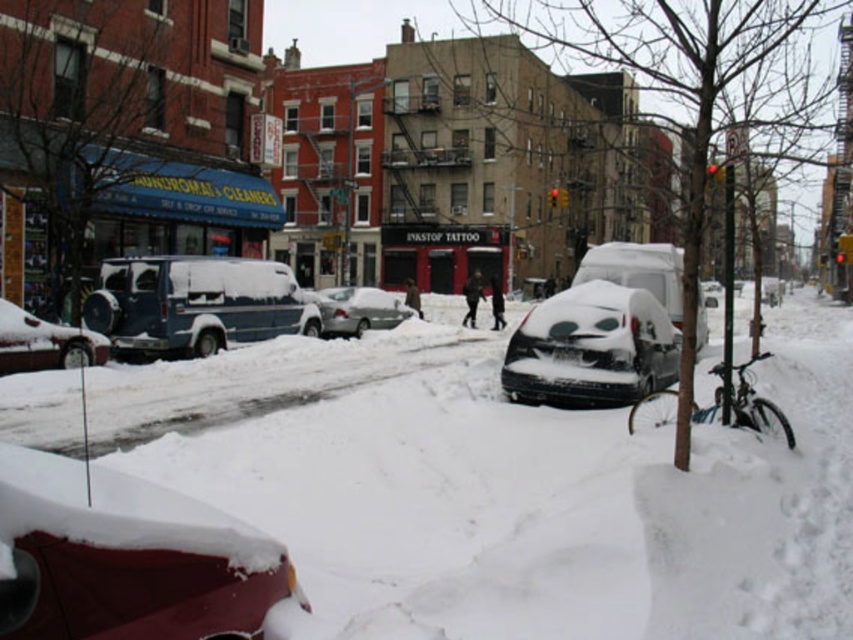
Who is taller, white fluffy snow at center or snow-covered car at center?

With more height is snow-covered car at center.

Can you confirm if white fluffy snow at center is shorter than snow-covered car at center?

Indeed, white fluffy snow at center has a lesser height compared to snow-covered car at center.

Is point (518, 538) positioned behind point (572, 308)?

No, it is in front of (572, 308).

Where is `white fluffy snow at center`? Image resolution: width=853 pixels, height=640 pixels. white fluffy snow at center is located at coordinates (548, 506).

Which is more to the right, blue matte van at center-left or snow-covered car at center?

snow-covered car at center is more to the right.

How much distance is there between blue matte van at center-left and snow-covered car at center?

They are 9.55 meters apart.

You are a GUI agent. You are given a task and a screenshot of the screen. Output one action in this format:
    pyautogui.click(x=<x>, y=<y>)
    Task: Click on the blue matte van at center-left
    The height and width of the screenshot is (640, 853).
    Given the screenshot: What is the action you would take?
    pyautogui.click(x=194, y=305)

Identify the location of blue matte van at center-left. (194, 305).

Can you confirm if white fluffy snow at center is positioned below silver metallic sedan at center?

Yes.

The height and width of the screenshot is (640, 853). What do you see at coordinates (548, 506) in the screenshot?
I see `white fluffy snow at center` at bounding box center [548, 506].

Where is `white fluffy snow at center`? white fluffy snow at center is located at coordinates (548, 506).